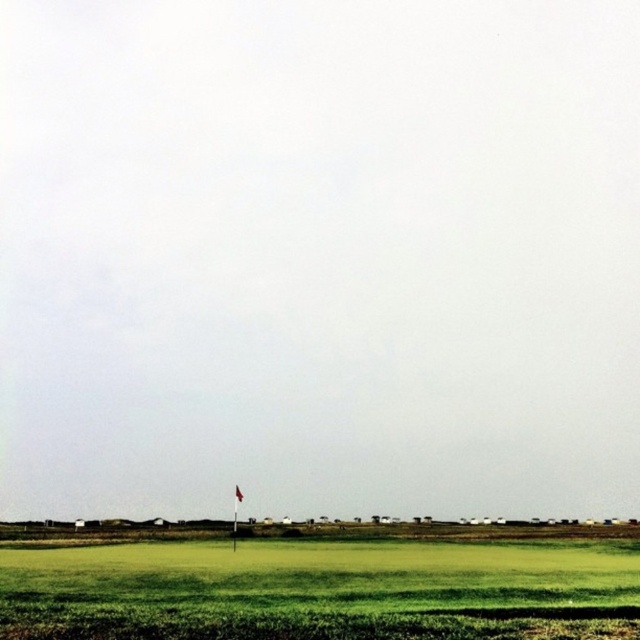
Which is below, green grassy field at lower center or red fabric flag at center?

red fabric flag at center

Find the location of a particular element. This screenshot has width=640, height=640. green grassy field at lower center is located at coordinates (321, 592).